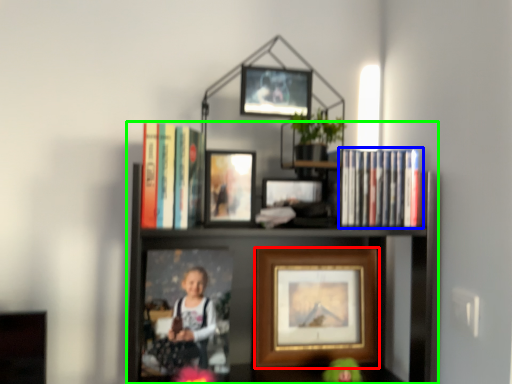
Question: Estimate the real-world distances between objects in this image. Which object is farther from picture frame (highlighted by a red box), book (highlighted by a blue box) or shelf (highlighted by a green box)?

Choices:
 (A) book
 (B) shelf

Answer: (A)